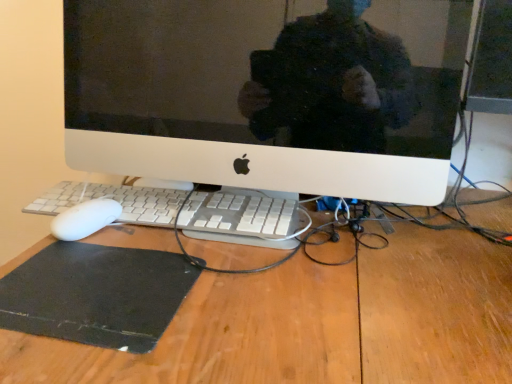
Locate an element on the screen. vacant area that is situated to the right of white plastic computer monitor at center is located at coordinates (448, 242).